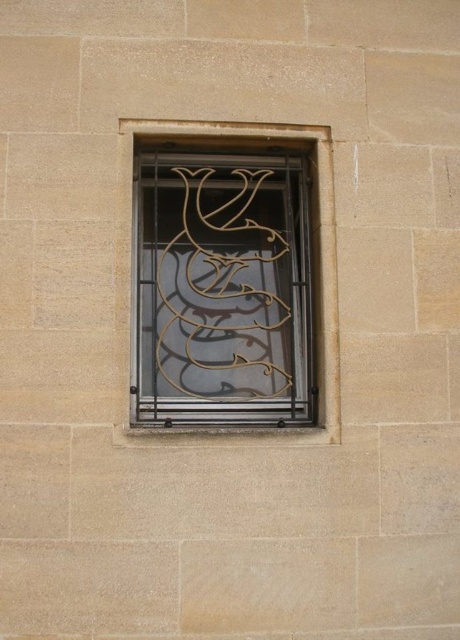
Question: Does gold wrought iron at center lie in front of metallic wire at center?

Choices:
 (A) no
 (B) yes

Answer: (A)

Question: Is gold wrought iron at center wider than metallic wire at center?

Choices:
 (A) yes
 (B) no

Answer: (B)

Question: Which point appears closest to the camera in this image?

Choices:
 (A) (216, 253)
 (B) (127, 122)

Answer: (B)

Question: Can you confirm if gold wrought iron at center is positioned to the right of metallic wire at center?

Choices:
 (A) yes
 (B) no

Answer: (B)